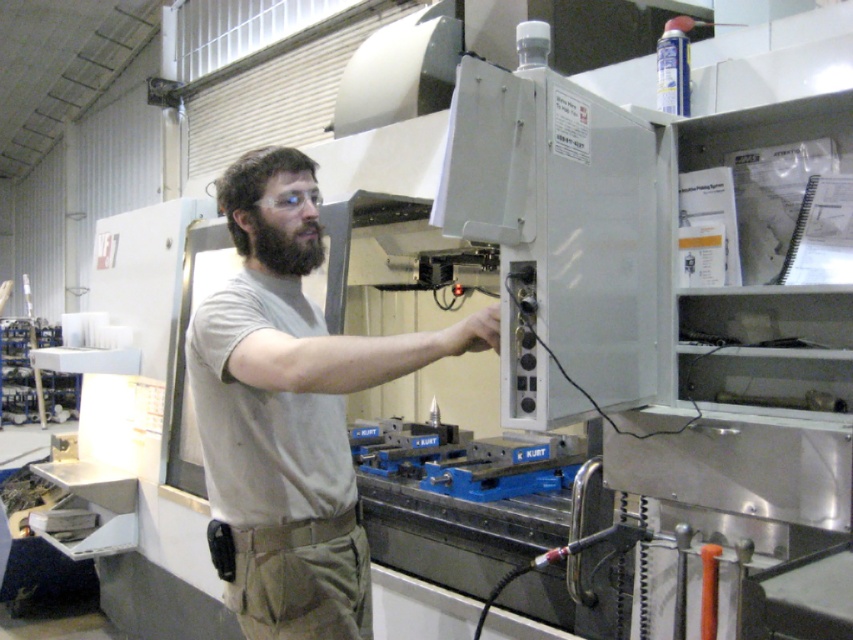
Who is more distant from viewer, (247,451) or (271,244)?

Positioned behind is point (271,244).

Is light gray shirt at center closer to camera compared to black fuzzy beard at center?

That is True.

This screenshot has height=640, width=853. I want to click on light gray shirt at center, so click(289, 420).

Find the location of a particular element. This screenshot has width=853, height=640. light gray shirt at center is located at coordinates (289, 420).